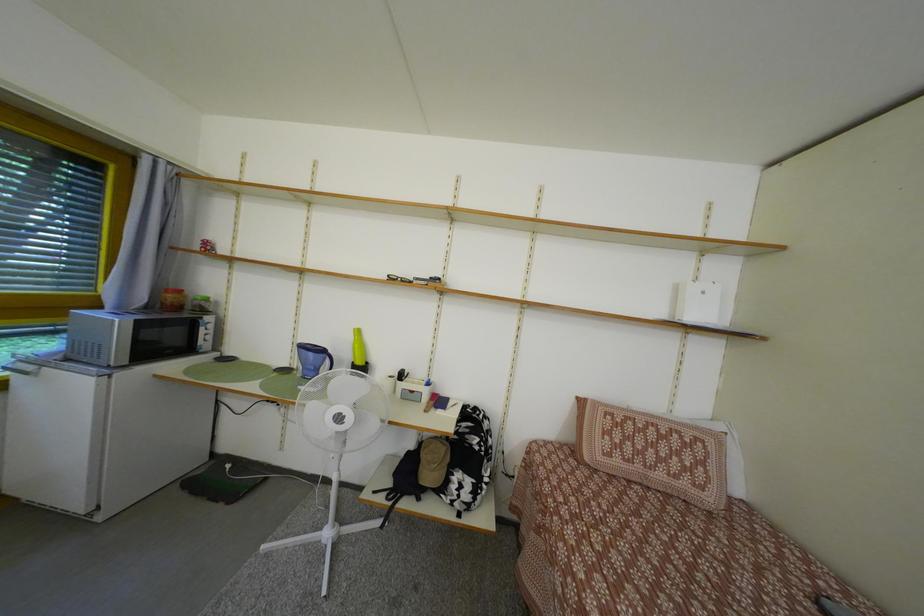
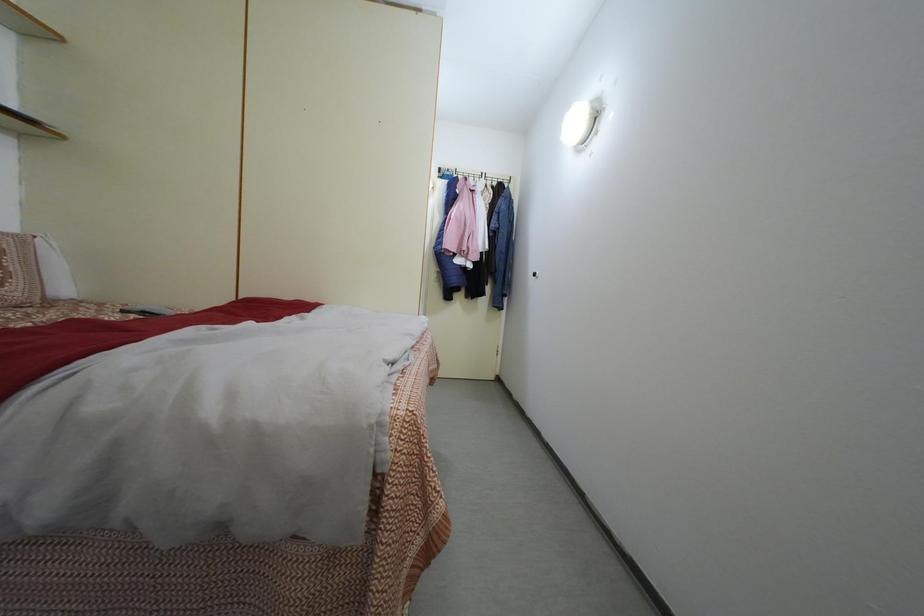
Question: The images are taken continuously from a first-person perspective. In which direction is your viewpoint rotating?

Choices:
 (A) Left
 (B) Right
 (C) Up
 (D) Down

Answer: (B)